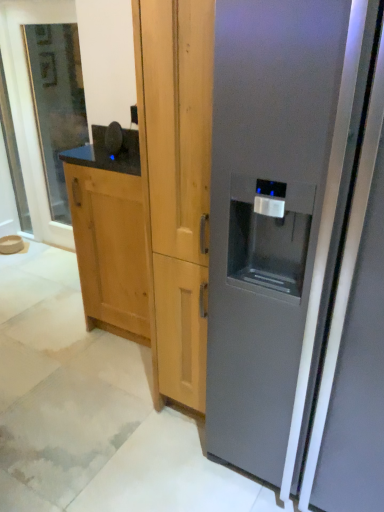
Question: Considering the relative sizes of natural wood cabinet at left and clear glass door at left in the image provided, is natural wood cabinet at left shorter than clear glass door at left?

Choices:
 (A) yes
 (B) no

Answer: (A)

Question: From the image's perspective, is natural wood cabinet at left on clear glass door at left?

Choices:
 (A) no
 (B) yes

Answer: (A)

Question: Can you see natural wood cabinet at left touching clear glass door at left?

Choices:
 (A) no
 (B) yes

Answer: (A)

Question: Can we say natural wood cabinet at left lies outside clear glass door at left?

Choices:
 (A) no
 (B) yes

Answer: (B)

Question: Can you confirm if natural wood cabinet at left is positioned to the left of clear glass door at left?

Choices:
 (A) yes
 (B) no

Answer: (B)

Question: Visually, is clear glass door at left positioned to the left or to the right of satin gray refrigerator at right?

Choices:
 (A) left
 (B) right

Answer: (A)

Question: In terms of size, does clear glass door at left appear bigger or smaller than satin gray refrigerator at right?

Choices:
 (A) small
 (B) big

Answer: (A)

Question: Which is correct: clear glass door at left is inside satin gray refrigerator at right, or outside of it?

Choices:
 (A) inside
 (B) outside

Answer: (B)

Question: Is point (31, 38) positioned closer to the camera than point (248, 398)?

Choices:
 (A) farther
 (B) closer

Answer: (A)

Question: Does point (274, 27) appear closer or farther from the camera than point (107, 251)?

Choices:
 (A) farther
 (B) closer

Answer: (B)

Question: In terms of width, does satin gray refrigerator at right look wider or thinner when compared to natural wood cabinet at left?

Choices:
 (A) thin
 (B) wide

Answer: (B)

Question: Is satin gray refrigerator at right to the left or to the right of natural wood cabinet at left in the image?

Choices:
 (A) right
 (B) left

Answer: (A)

Question: From a real-world perspective, is satin gray refrigerator at right above or below natural wood cabinet at left?

Choices:
 (A) below
 (B) above

Answer: (B)

Question: Visually, is satin gray refrigerator at right positioned to the left or to the right of clear glass door at left?

Choices:
 (A) left
 (B) right

Answer: (B)

Question: From a real-world perspective, is satin gray refrigerator at right physically located above or below clear glass door at left?

Choices:
 (A) below
 (B) above

Answer: (A)